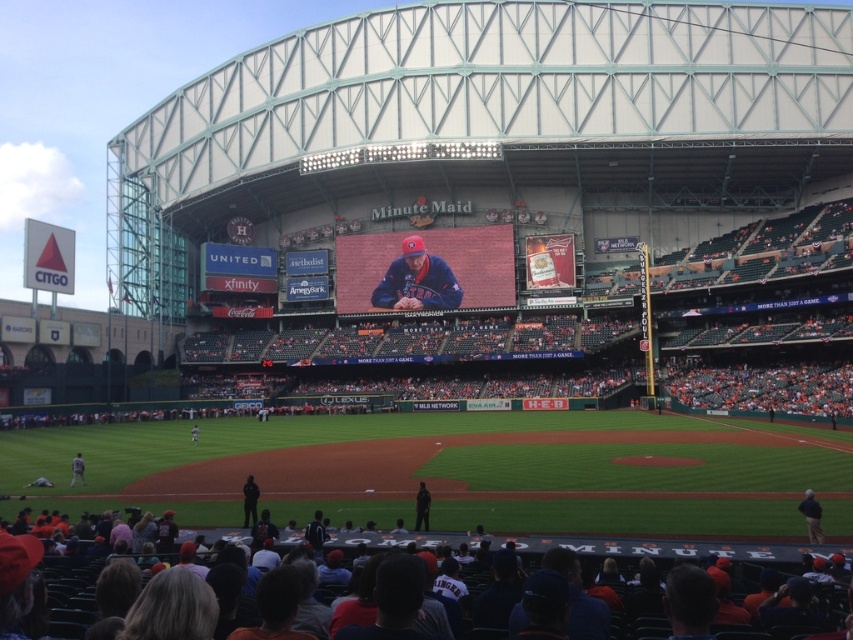
You are a photographer standing at the center of Minute Maid Park, aiming to capture both the black fabric jacket at lower right and the gray fabric jacket at lower left in a single shot. Which jacket will appear larger in your photo?

The black fabric jacket at lower right will appear larger in the photo because it is closer to the viewer than the gray fabric jacket at lower left.

You are a photographer standing at the center of Minute Maid Park. You want to take a photo of the MLB Network logo and the black fabric jacket at lower right. Based on their positions, which one is closer to the right edge of your camera frame?

The black fabric jacket at lower right is closer to the right edge of your camera frame because its 2D location at point 0.808 on the x axis is closer to 1.0 than the MLB Network logo, which is positioned to the left of the scoreboard.

You are a photographer at Minute Maid Park and want to capture a photo of the matte blue cap at center and the black uniform at lower center. Which object appears taller in the image?

The matte blue cap at center is much taller than the black uniform at lower center.